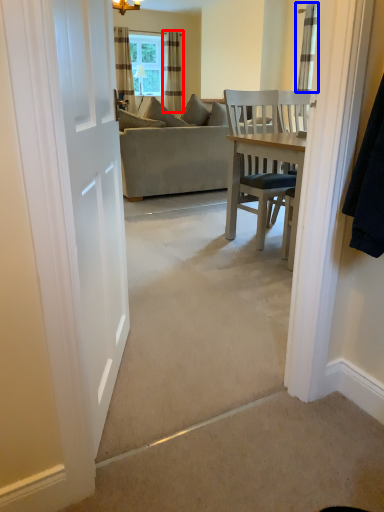
Question: Which point is further to the camera, curtain (highlighted by a red box) or curtain (highlighted by a blue box)?

Choices:
 (A) curtain
 (B) curtain

Answer: (A)